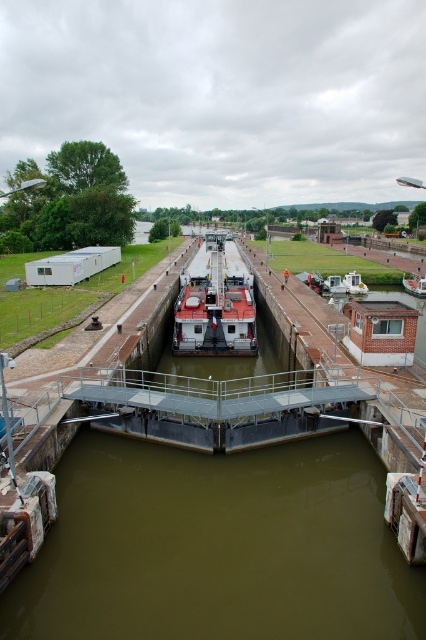
Looking at this image, you are a boat operator trying to navigate through the canal lock. You see a red matte boat at center and a wooden boat at center. Which boat is positioned higher in the water level?

The red matte boat at center is located above the wooden boat at center, so it is positioned higher in the water level.